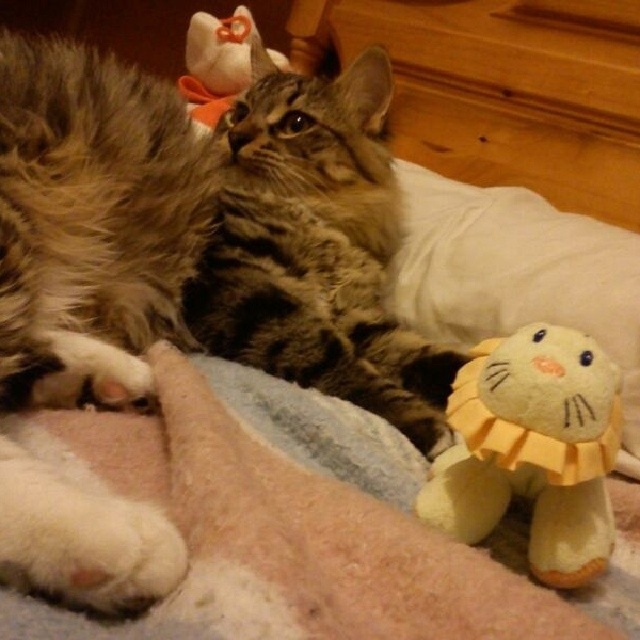
Question: Considering the relative positions of fuzzy brown tabby cat at center and yellow fabric pillow at lower right in the image provided, where is fuzzy brown tabby cat at center located with respect to yellow fabric pillow at lower right?

Choices:
 (A) below
 (B) above

Answer: (B)

Question: Which of the following is the farthest from the observer?

Choices:
 (A) (305, 397)
 (B) (305, 166)

Answer: (B)

Question: Can you confirm if yellow plush toy at lower right is positioned above soft blue fabric at lower center?

Choices:
 (A) yes
 (B) no

Answer: (B)

Question: Which of the following is the farthest from the observer?

Choices:
 (A) yellow fabric pillow at lower right
 (B) fuzzy brown tabby cat at center
 (C) fuzzy brown cat at center

Answer: (A)

Question: Which object is farther from the camera taking this photo?

Choices:
 (A) yellow fabric pillow at lower right
 (B) soft blue fabric at lower center
 (C) fuzzy brown tabby cat at center
 (D) yellow plush toy at lower right

Answer: (A)

Question: Does fuzzy brown cat at center appear on the left side of yellow plush toy at lower right?

Choices:
 (A) yes
 (B) no

Answer: (A)